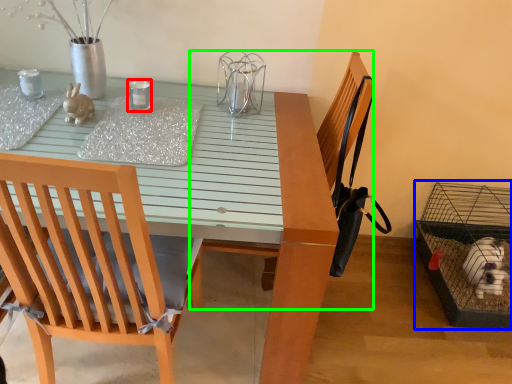
Question: Based on their relative distances, which object is farther from candle holder (highlighted by a red box)? Choose from bird cage (highlighted by a blue box) and armchair (highlighted by a green box).

Choices:
 (A) bird cage
 (B) armchair

Answer: (A)